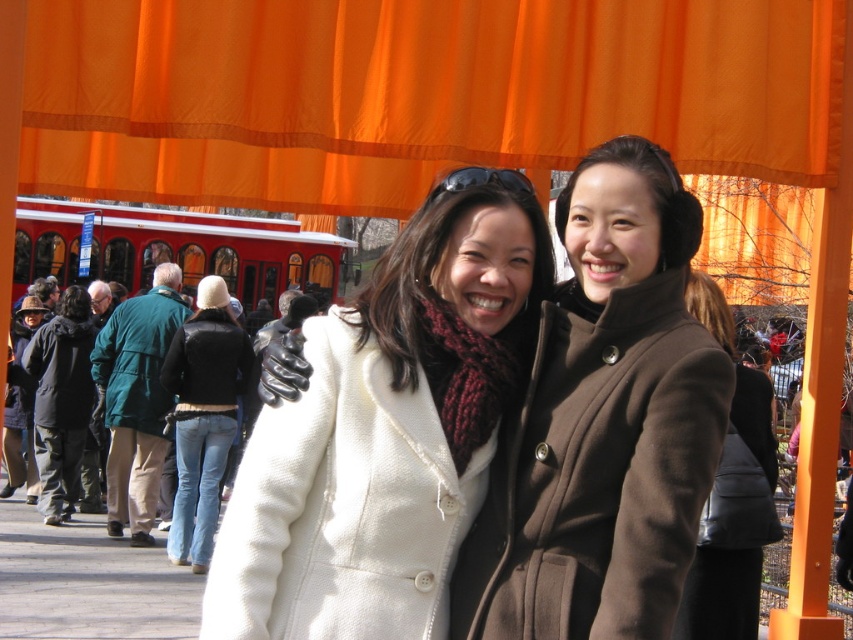
Who is more distant from viewer, [529,113] or [231,326]?

Point [231,326]

Does orange fabric curtain at upper center have a lesser height compared to black leather jacket at center?

Correct, orange fabric curtain at upper center is not as tall as black leather jacket at center.

In order to click on orange fabric curtain at upper center in this screenshot , I will do `click(415, 93)`.

Is white woolen coat at center positioned behind black fuzzy coat at center?

No, it is not.

The width and height of the screenshot is (853, 640). I want to click on white woolen coat at center, so click(343, 506).

Where is `white woolen coat at center`? white woolen coat at center is located at coordinates (343, 506).

Is orange fabric curtain at upper center thinner than brown wool coat at center?

No.

Does orange fabric curtain at upper center have a greater width compared to brown wool coat at center?

Yes.

What do you see at coordinates (415, 93) in the screenshot?
I see `orange fabric curtain at upper center` at bounding box center [415, 93].

The width and height of the screenshot is (853, 640). In order to click on orange fabric curtain at upper center in this screenshot , I will do `click(415, 93)`.